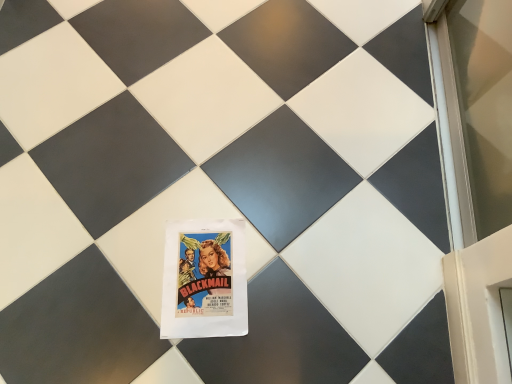
Where is `free space in front of matte paper poster at center`? free space in front of matte paper poster at center is located at coordinates (182, 354).